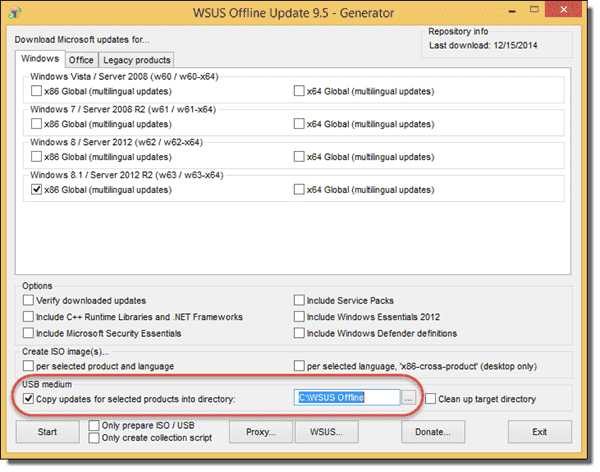
At what (x,y) coordinates should I click in order to perform the action: click on gold trim. Please return your answer as a coordinate pair (x, y). Looking at the image, I should click on point(111,12), point(3,355), point(192,455), point(585,251).